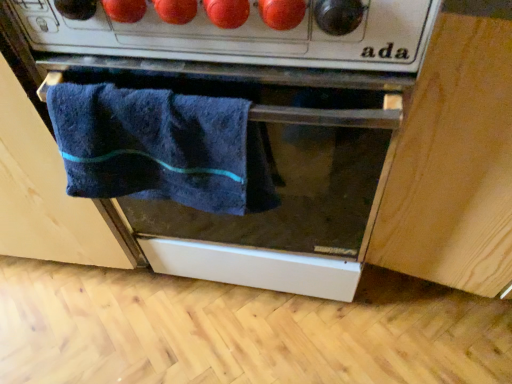
Question: Does dark blue towel at center, marked as the first cabinetry in a left-to-right arrangement, have a smaller size compared to matte black oven at center?

Choices:
 (A) no
 (B) yes

Answer: (A)

Question: Is dark blue towel at center, marked as the first cabinetry in a left-to-right arrangement, facing away from matte black oven at center?

Choices:
 (A) yes
 (B) no

Answer: (B)

Question: Could matte black oven at center be considered to be inside dark blue towel at center, which is the 2th cabinetry in right-to-left order?

Choices:
 (A) yes
 (B) no

Answer: (B)

Question: Can you confirm if dark blue towel at center, which is the 2th cabinetry in right-to-left order, is thinner than matte black oven at center?

Choices:
 (A) yes
 (B) no

Answer: (A)

Question: Does dark blue towel at center, marked as the first cabinetry in a left-to-right arrangement, turn towards matte black oven at center?

Choices:
 (A) no
 (B) yes

Answer: (A)

Question: Is matte black oven at center in front of or behind dark blue towel at center, which is the 2th cabinetry in right-to-left order, in the image?

Choices:
 (A) front
 (B) behind

Answer: (A)

Question: From a real-world perspective, is matte black oven at center positioned above or below dark blue towel at center, marked as the first cabinetry in a left-to-right arrangement?

Choices:
 (A) below
 (B) above

Answer: (A)

Question: Is matte black oven at center wider or thinner than dark blue towel at center, which is the 2th cabinetry in right-to-left order?

Choices:
 (A) wide
 (B) thin

Answer: (A)

Question: Is matte black oven at center taller or shorter than dark blue towel at center, which is the 2th cabinetry in right-to-left order?

Choices:
 (A) tall
 (B) short

Answer: (B)

Question: From the image's perspective, is light wood cabinet at lower right, the 1th cabinetry from the right, above or below matte black oven at center?

Choices:
 (A) below
 (B) above

Answer: (B)

Question: Is light wood cabinet at lower right, the 1th cabinetry from the right, spatially inside matte black oven at center, or outside of it?

Choices:
 (A) outside
 (B) inside

Answer: (A)

Question: From a real-world perspective, relative to matte black oven at center, is light wood cabinet at lower right, the 1th cabinetry from the right, vertically above or below?

Choices:
 (A) below
 (B) above

Answer: (B)

Question: Considering their positions, is light wood cabinet at lower right, the second cabinetry in the left-to-right sequence, located in front of or behind matte black oven at center?

Choices:
 (A) front
 (B) behind

Answer: (A)

Question: In the image, is dark blue towel at center, marked as the first cabinetry in a left-to-right arrangement, positioned in front of or behind light wood cabinet at lower right, the 1th cabinetry from the right?

Choices:
 (A) front
 (B) behind

Answer: (B)

Question: From the image's perspective, relative to light wood cabinet at lower right, the 1th cabinetry from the right, is dark blue towel at center, which is the 2th cabinetry in right-to-left order, above or below?

Choices:
 (A) above
 (B) below

Answer: (A)